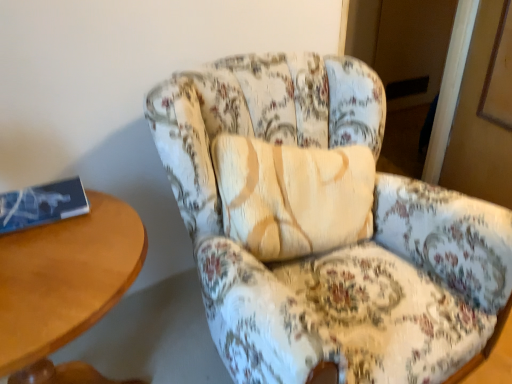
The height and width of the screenshot is (384, 512). I want to click on vacant space to the right of blue paper book at left, so click(93, 225).